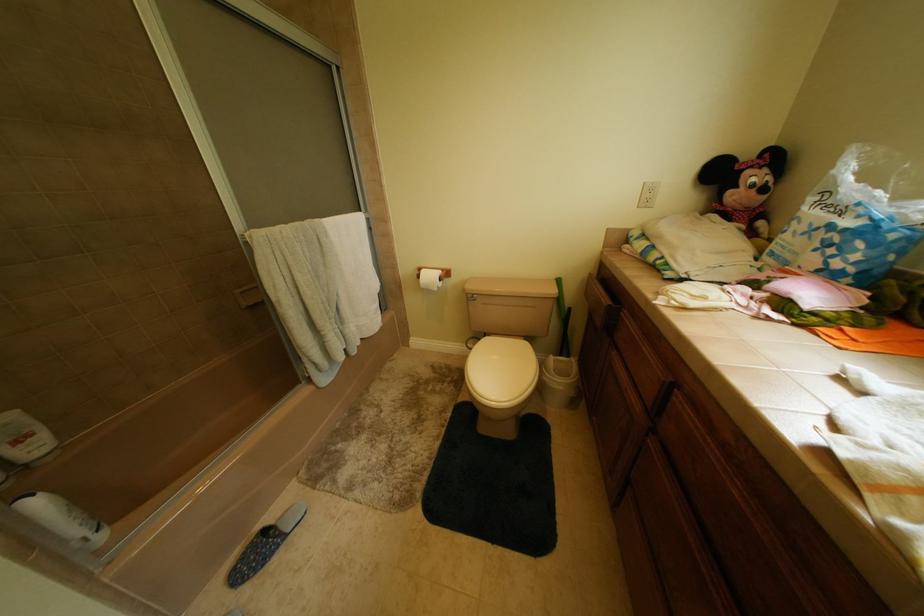
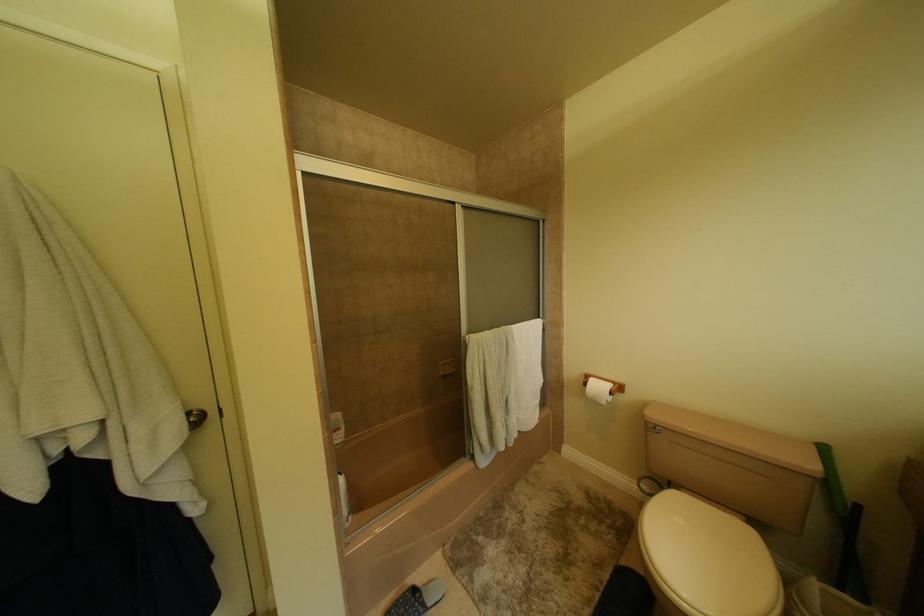
Question: The camera is either moving clockwise (left) or counter-clockwise (right) around the object. The first image is from the beginning of the video and the second image is from the end. Is the camera moving left or right when shooting the video?

Choices:
 (A) Left
 (B) Right

Answer: (B)